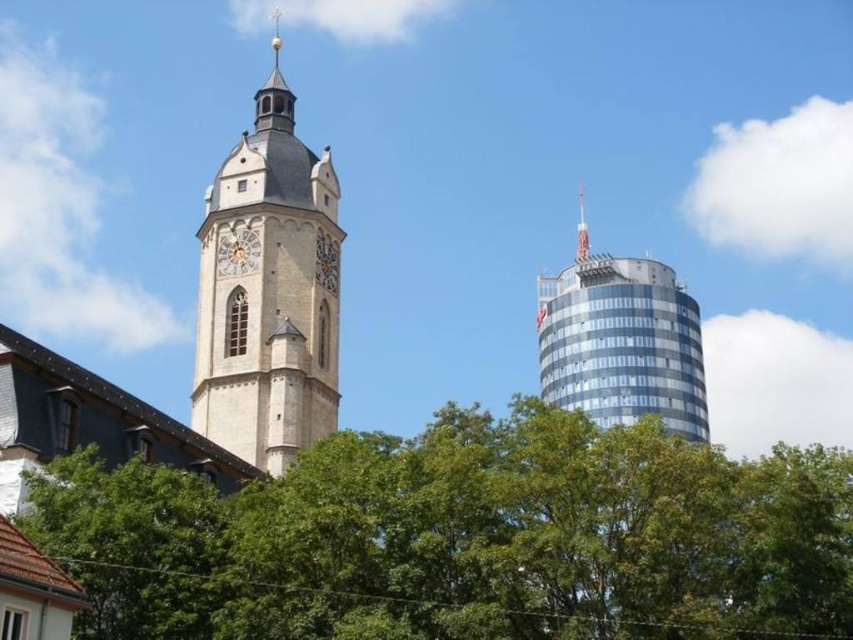
Between point (619, 340) and point (581, 198), which one is positioned behind?

The point (581, 198) is behind.

Between point (596, 385) and point (583, 205), which one is positioned in front?

Point (596, 385) is in front.

Image resolution: width=853 pixels, height=640 pixels. I want to click on blue glass skyscraper at right, so click(622, 344).

Is green leafy tree at center above beige stone tower at left?

No.

Measure the distance between point [468,580] and camera.

Point [468,580] is 39.89 meters away from camera.

Where is `green leafy tree at center`? This screenshot has width=853, height=640. green leafy tree at center is located at coordinates (463, 538).

This screenshot has height=640, width=853. Identify the location of green leafy tree at center. (463, 538).

Does green leafy tree at center appear under polished silver spire at upper right?

Yes.

Is green leafy tree at center positioned in front of polished silver spire at upper right?

Yes, green leafy tree at center is in front of polished silver spire at upper right.

Describe the element at coordinates (463, 538) in the screenshot. I see `green leafy tree at center` at that location.

Find the location of a particular element. The image size is (853, 640). green leafy tree at center is located at coordinates (x=463, y=538).